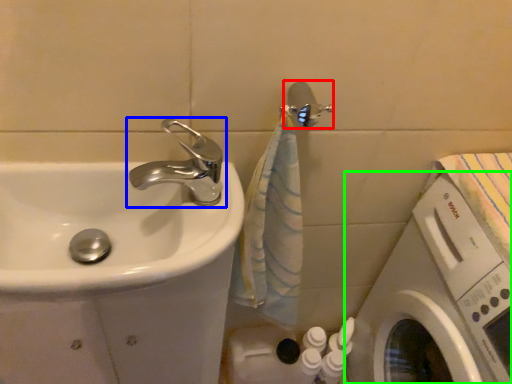
Question: Which object is positioned closest to shower (highlighted by a red box)? Select from tap (highlighted by a blue box) and washing machine (highlighted by a green box).

Choices:
 (A) tap
 (B) washing machine

Answer: (A)